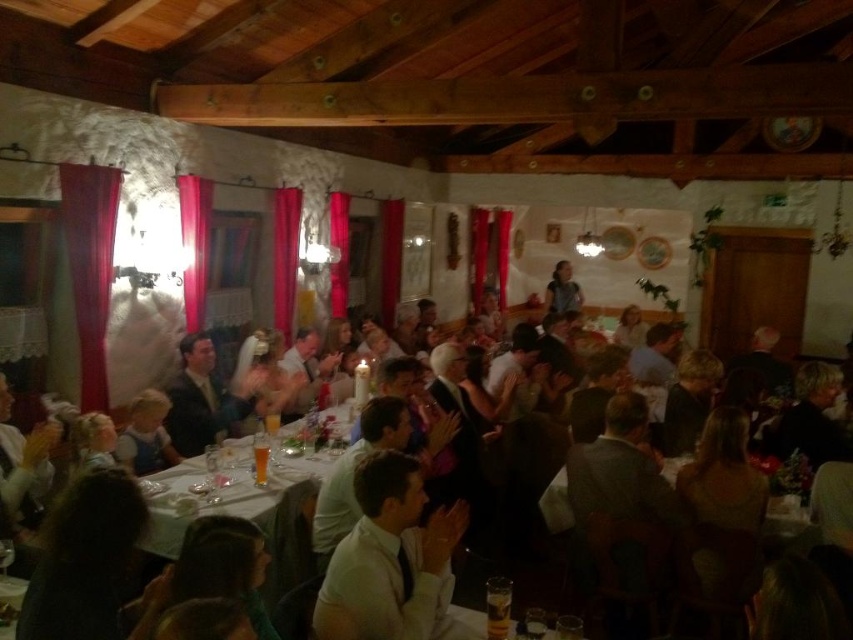
From the picture: You are a photographer at a wedding reception. You want to take a photo of the white satin shirt at center without the red velvet curtain at left showing in the background. Is this possible based on the scene?

The white satin shirt at center is in front of the red velvet curtain at left, so yes, you can take a photo of the white satin shirt at center without the red velvet curtain at left showing in the background by positioning the camera so the shirt blocks the curtain from view.